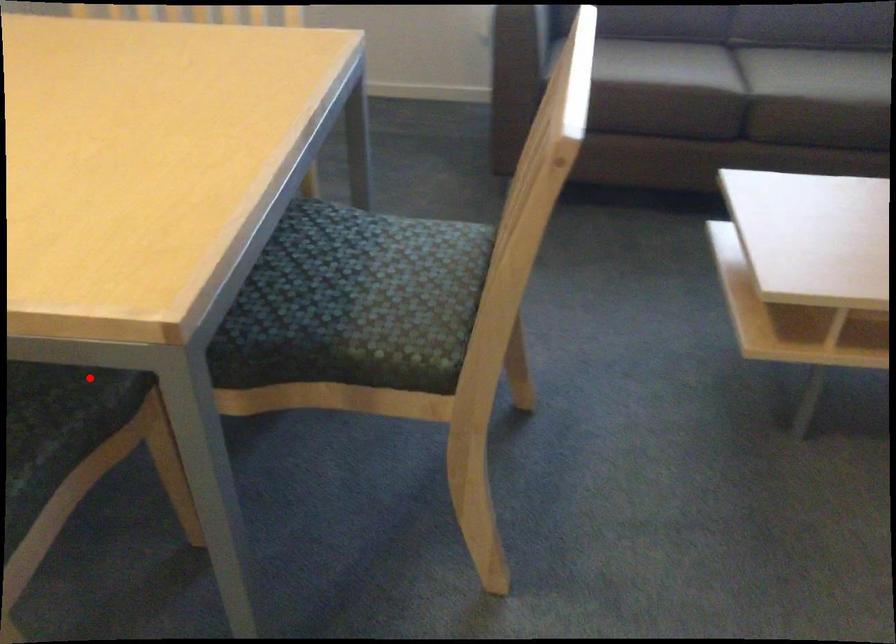
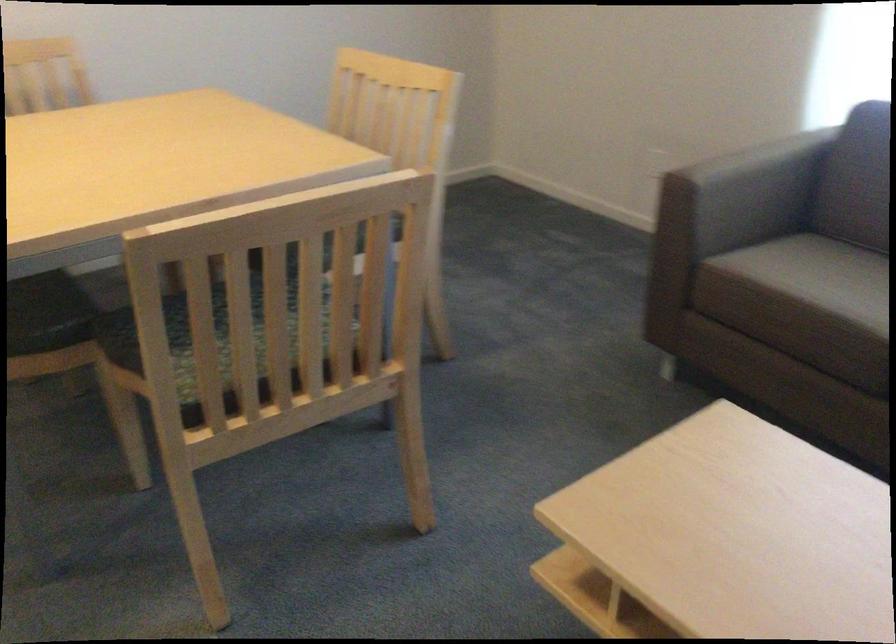
Question: I am providing you with two images of the same scene from different viewpoints. Given a red point in image1, look at the same physical point in image2. Is it:

Choices:
 (A) Closer to the viewpoint
 (B) Farther from the viewpoint

Answer: (B)